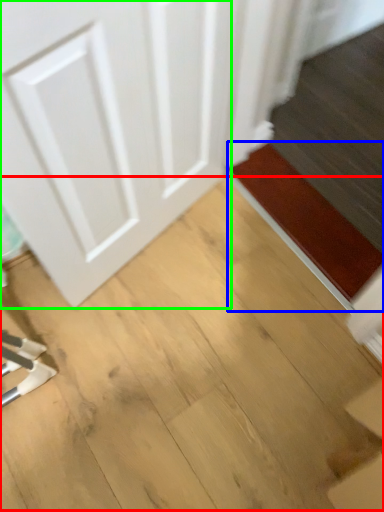
Question: Estimate the real-world distances between objects in this image. Which object is closer to plywood (highlighted by a red box), doormat (highlighted by a blue box) or door (highlighted by a green box)?

Choices:
 (A) doormat
 (B) door

Answer: (A)